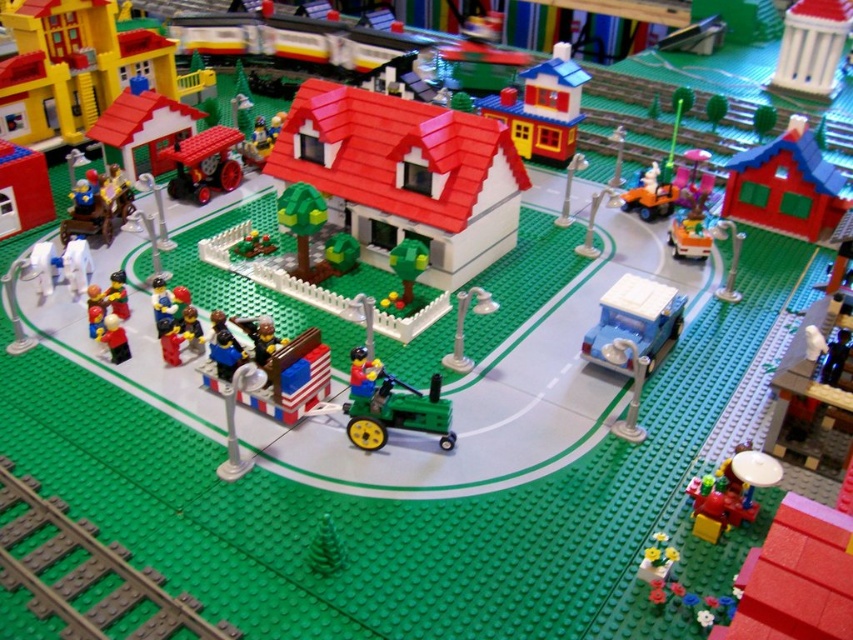
What are the coordinates of the green plastic train track at bottom left?

The coordinates of the green plastic train track at bottom left are at point (85, 573).

You are a tiny Lego figure standing at point A with coordinates point A at (189, 140) and want to walk to point B at (323, 544). Which direction should you move to get closer to point B?

To move from point A at (189, 140) to point B at (323, 544), you should move towards the right and slightly forward since point A is behind point B.